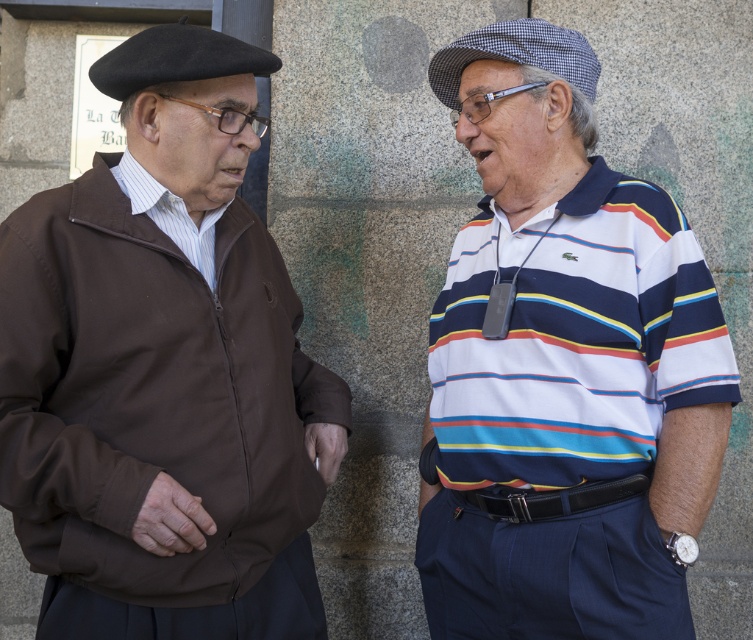
Based on the photo, is brown fabric jacket at left bigger than white striped polo shirt at center?

Yes, brown fabric jacket at left is bigger than white striped polo shirt at center.

Is brown fabric jacket at left to the right of white striped polo shirt at center from the viewer's perspective?

Incorrect, brown fabric jacket at left is not on the right side of white striped polo shirt at center.

Describe the element at coordinates (163, 371) in the screenshot. This screenshot has width=753, height=640. I see `brown fabric jacket at left` at that location.

Find the location of `brown fabric jacket at left`. brown fabric jacket at left is located at coordinates (163, 371).